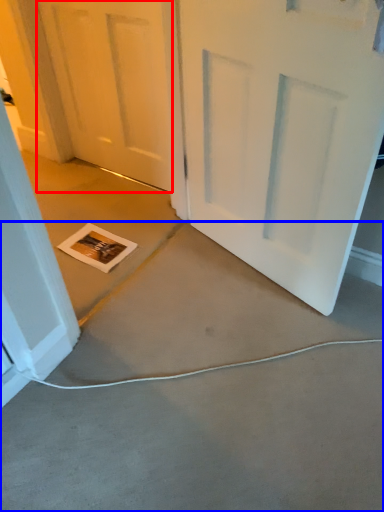
Question: Which point is closer to the camera, door (highlighted by a red box) or concrete (highlighted by a blue box)?

Choices:
 (A) door
 (B) concrete

Answer: (B)